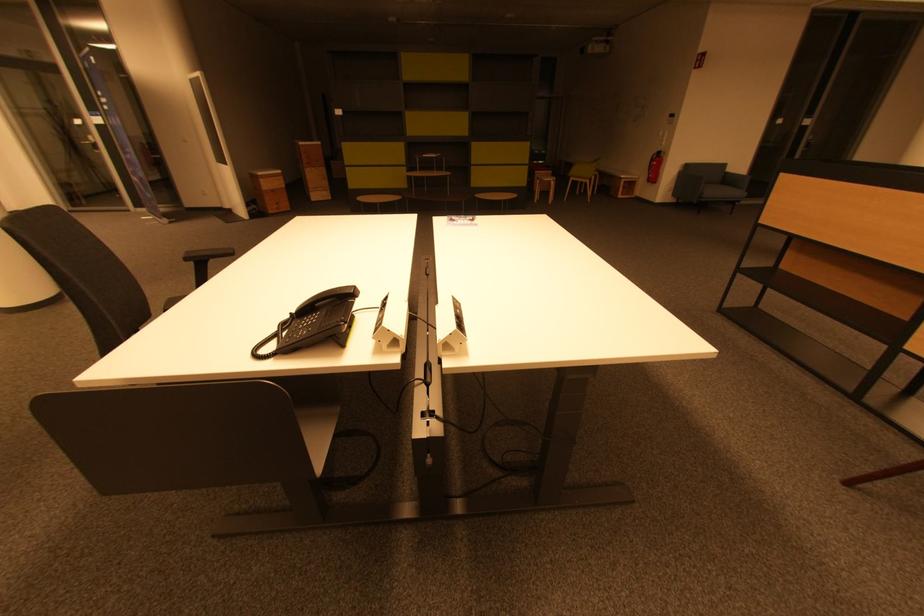
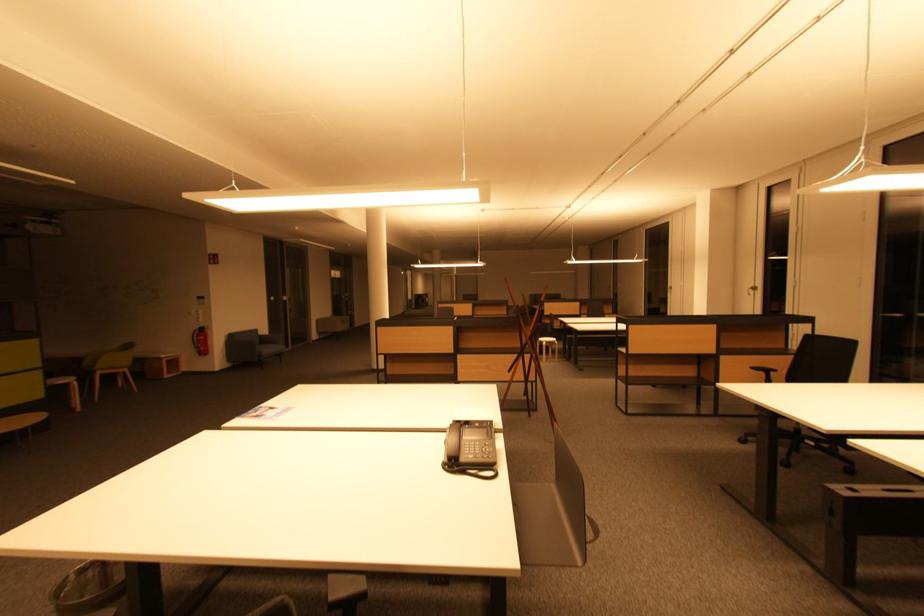
The point at (691, 169) is marked in the first image. Where is the corresponding point in the second image?

(236, 339)